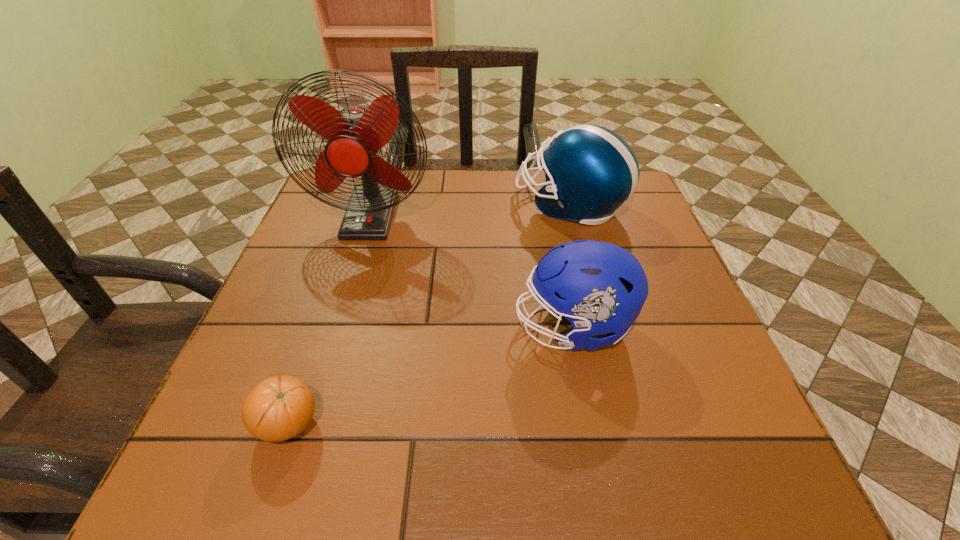
Where is `vacant region between the nearer football helmet and the tallest object`? vacant region between the nearer football helmet and the tallest object is located at coordinates (471, 272).

Identify the location of vacant point located between the fan and the shortest object. (329, 320).

The image size is (960, 540). In order to click on blank region between the fan and the nearest object in this screenshot , I will do click(x=329, y=320).

The width and height of the screenshot is (960, 540). I want to click on the third closest object relative to the second nearest object, so click(x=280, y=407).

Identify which object is the second nearest to the nearer football helmet. Please provide its 2D coordinates. Your answer should be formatted as a tuple, i.e. [(x, y)], where the tuple contains the x and y coordinates of a point satisfying the conditions above.

[(355, 135)]

At what (x,y) coordinates should I click in order to perform the action: click on blank area in the image that satisfies the following two spatial constraints: 1. on the face guard of the nearer football helmet; 2. on the front side of the shortest object. Please return your answer as a coordinate pair (x, y). The height and width of the screenshot is (540, 960). Looking at the image, I should click on (592, 424).

Find the location of a particular element. free spot that satisfies the following two spatial constraints: 1. on the face guard of the third farthest object; 2. on the front side of the shortest object is located at coordinates (592, 424).

Where is `free space that satisfies the following two spatial constraints: 1. at the front of the farther football helmet with the faceguard; 2. on the front-facing side of the tallest object`? This screenshot has width=960, height=540. free space that satisfies the following two spatial constraints: 1. at the front of the farther football helmet with the faceguard; 2. on the front-facing side of the tallest object is located at coordinates (573, 216).

You are a GUI agent. You are given a task and a screenshot of the screen. Output one action in this format:
    pyautogui.click(x=<x>, y=<y>)
    Task: Click on the free space that satisfies the following two spatial constraints: 1. at the front of the farther football helmet with the faceguard; 2. on the front side of the shortest object
    
    Given the screenshot: What is the action you would take?
    pyautogui.click(x=628, y=424)